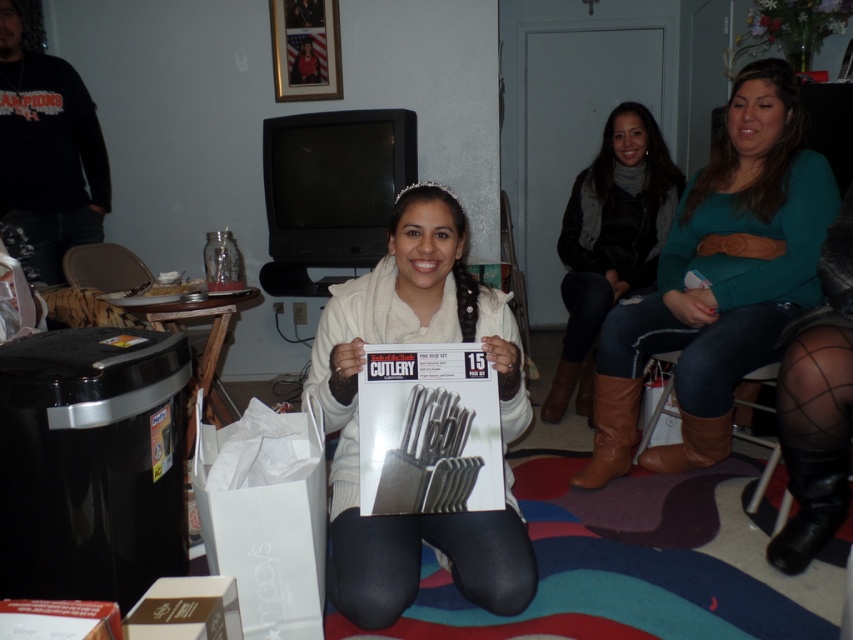
Question: Can you confirm if black leather boot at lower right is positioned to the left of brown leather boot at lower center?

Choices:
 (A) no
 (B) yes

Answer: (A)

Question: Which of the following is the closest to the observer?

Choices:
 (A) brown suede boot at lower right
 (B) dark brown leather boots at right
 (C) brown leather boot at lower center
 (D) black leather boot at lower right

Answer: (D)

Question: Does white matte sweater at center lie in front of dark brown leather boots at right?

Choices:
 (A) no
 (B) yes

Answer: (B)

Question: Which object appears closest to the camera in this image?

Choices:
 (A) teal sweater at center
 (B) dark brown leather boots at right

Answer: (A)

Question: Can you confirm if white matte sweater at center is positioned below brown suede boot at lower right?

Choices:
 (A) no
 (B) yes

Answer: (A)

Question: Which is farther from the brown suede boot at lower right?

Choices:
 (A) teal sweater at center
 (B) black leather boot at lower right
 (C) dark brown leather boots at right

Answer: (C)